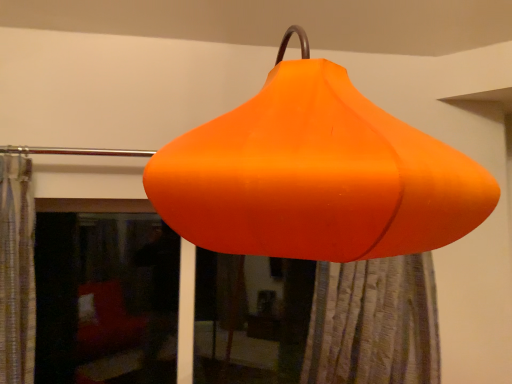
What do you see at coordinates (316, 175) in the screenshot? This screenshot has height=384, width=512. I see `orange matte lampshade at center` at bounding box center [316, 175].

Image resolution: width=512 pixels, height=384 pixels. Find the location of `orange fabric shower curtain at lower center`. orange fabric shower curtain at lower center is located at coordinates (374, 323).

Image resolution: width=512 pixels, height=384 pixels. What are the coordinates of `transparent glass window at lower left` in the screenshot? It's located at (105, 299).

Which is more to the right, orange fabric shower curtain at lower center or orange matte lampshade at center?

orange fabric shower curtain at lower center.

Considering the relative sizes of orange fabric shower curtain at lower center and orange matte lampshade at center in the image provided, is orange fabric shower curtain at lower center bigger than orange matte lampshade at center?

Actually, orange fabric shower curtain at lower center might be smaller than orange matte lampshade at center.

You are a GUI agent. You are given a task and a screenshot of the screen. Output one action in this format:
    pyautogui.click(x=<x>, y=<y>)
    Task: Click on the lantern lying in front of the orange fabric shower curtain at lower center
    The width and height of the screenshot is (512, 384).
    Given the screenshot: What is the action you would take?
    pyautogui.click(x=316, y=175)

From a real-world perspective, which object stands above the other?

orange matte lampshade at center, from a real-world perspective.

Which object is positioned more to the left, orange fabric shower curtain at lower center or transparent glass window at lower left?

transparent glass window at lower left.

Is orange fabric shower curtain at lower center situated inside transparent glass window at lower left or outside?

orange fabric shower curtain at lower center is not enclosed by transparent glass window at lower left.

From the image's perspective, which is below, orange fabric shower curtain at lower center or transparent glass window at lower left?

orange fabric shower curtain at lower center.

Is orange fabric shower curtain at lower center aimed at transparent glass window at lower left?

No, orange fabric shower curtain at lower center is not turned towards transparent glass window at lower left.

Consider the image. Which of these two, transparent glass window at lower left or orange fabric shower curtain at lower center, is bigger?

orange fabric shower curtain at lower center.

Would you say transparent glass window at lower left is a long distance from orange fabric shower curtain at lower center?

Indeed, transparent glass window at lower left is not near orange fabric shower curtain at lower center.

The width and height of the screenshot is (512, 384). In order to click on window screen above the orange fabric shower curtain at lower center (from the image's perspective) in this screenshot , I will do `click(105, 299)`.

Does point (85, 336) come in front of point (321, 346)?

No, it is not.

Is transparent glass window at lower left far from orange matte lampshade at center?

Yes, transparent glass window at lower left is far from orange matte lampshade at center.

From the image's perspective, is transparent glass window at lower left positioned above or below orange matte lampshade at center?

transparent glass window at lower left is situated lower than orange matte lampshade at center in the image.

How different are the orientations of transparent glass window at lower left and orange matte lampshade at center in degrees?

3.03 degrees.

Is the position of transparent glass window at lower left more distant than that of orange matte lampshade at center?

Yes, the depth of transparent glass window at lower left is greater than that of orange matte lampshade at center.

Considering the sizes of orange matte lampshade at center and transparent glass window at lower left in the image, is orange matte lampshade at center taller or shorter than transparent glass window at lower left?

In the image, orange matte lampshade at center appears to be taller than transparent glass window at lower left.

From a real-world perspective, is orange matte lampshade at center physically located above or below transparent glass window at lower left?

Clearly, from a real-world perspective, orange matte lampshade at center is above transparent glass window at lower left.

Can you confirm if orange matte lampshade at center is positioned to the right of transparent glass window at lower left?

Correct, you'll find orange matte lampshade at center to the right of transparent glass window at lower left.

Between orange matte lampshade at center and orange fabric shower curtain at lower center, which one has smaller width?

orange fabric shower curtain at lower center is thinner.

Between orange matte lampshade at center and orange fabric shower curtain at lower center, which one appears on the right side from the viewer's perspective?

orange fabric shower curtain at lower center.

Is orange matte lampshade at center not inside orange fabric shower curtain at lower center?

orange matte lampshade at center is positioned outside orange fabric shower curtain at lower center.

Considering the sizes of objects orange matte lampshade at center and orange fabric shower curtain at lower center in the image provided, who is smaller, orange matte lampshade at center or orange fabric shower curtain at lower center?

orange fabric shower curtain at lower center is smaller.

Find the location of a particular element. This screenshot has height=384, width=512. shower curtain on the right side of orange matte lampshade at center is located at coordinates (374, 323).

Image resolution: width=512 pixels, height=384 pixels. Identify the location of window screen behind the orange fabric shower curtain at lower center. (105, 299).

Looking at the image, which one is located further to orange fabric shower curtain at lower center, orange matte lampshade at center or transparent glass window at lower left?

transparent glass window at lower left lies further to orange fabric shower curtain at lower center than the other object.

Which object lies further to the anchor point orange matte lampshade at center, orange fabric shower curtain at lower center or transparent glass window at lower left?

Based on the image, transparent glass window at lower left appears to be further to orange matte lampshade at center.

Looking at the image, which one is located further to transparent glass window at lower left, orange fabric shower curtain at lower center or orange matte lampshade at center?

The object further to transparent glass window at lower left is orange matte lampshade at center.

Estimate the real-world distances between objects in this image. Which object is further from orange fabric shower curtain at lower center, transparent glass window at lower left or orange matte lampshade at center?

transparent glass window at lower left is positioned further to the anchor orange fabric shower curtain at lower center.

Based on their spatial positions, is transparent glass window at lower left or orange fabric shower curtain at lower center closer to orange matte lampshade at center?

orange fabric shower curtain at lower center is closer to orange matte lampshade at center.

Based on their spatial positions, is orange matte lampshade at center or orange fabric shower curtain at lower center further from transparent glass window at lower left?

Among the two, orange matte lampshade at center is located further to transparent glass window at lower left.

This screenshot has height=384, width=512. What are the coordinates of `shower curtain positioned between orange matte lampshade at center and transparent glass window at lower left from near to far` in the screenshot? It's located at 374,323.